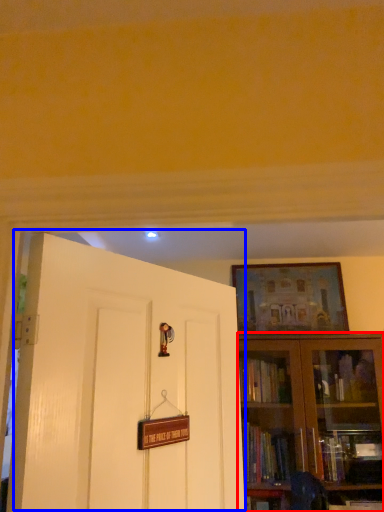
Question: Which of the following is the closest to the observer, bookcase (highlighted by a red box) or door (highlighted by a blue box)?

Choices:
 (A) bookcase
 (B) door

Answer: (B)